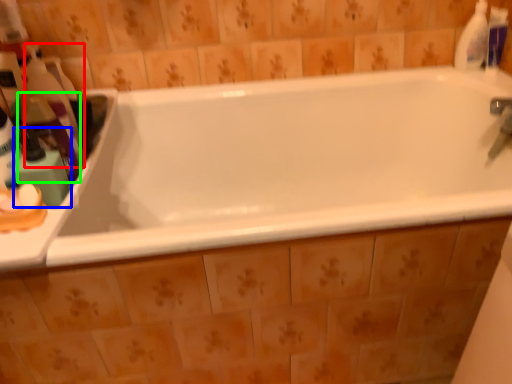
Question: Which object is the closest to the cleaning product (highlighted by a red box)? Choose among these: toiletry (highlighted by a blue box) or cleaning product (highlighted by a green box).

Choices:
 (A) toiletry
 (B) cleaning product

Answer: (B)